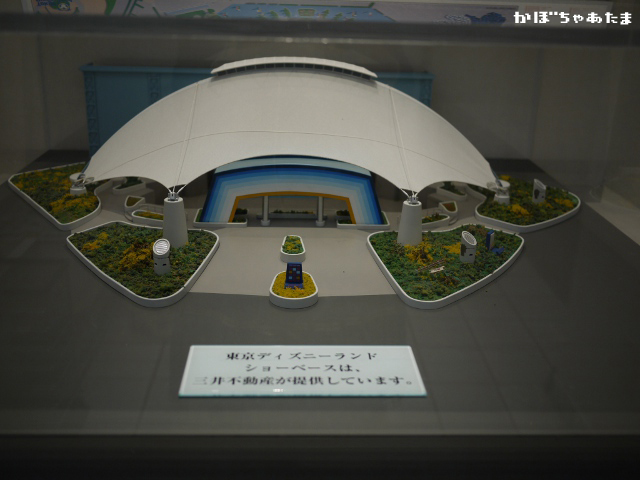
Image resolution: width=640 pixels, height=480 pixels. Identify the location of tiled floor. (537, 355).